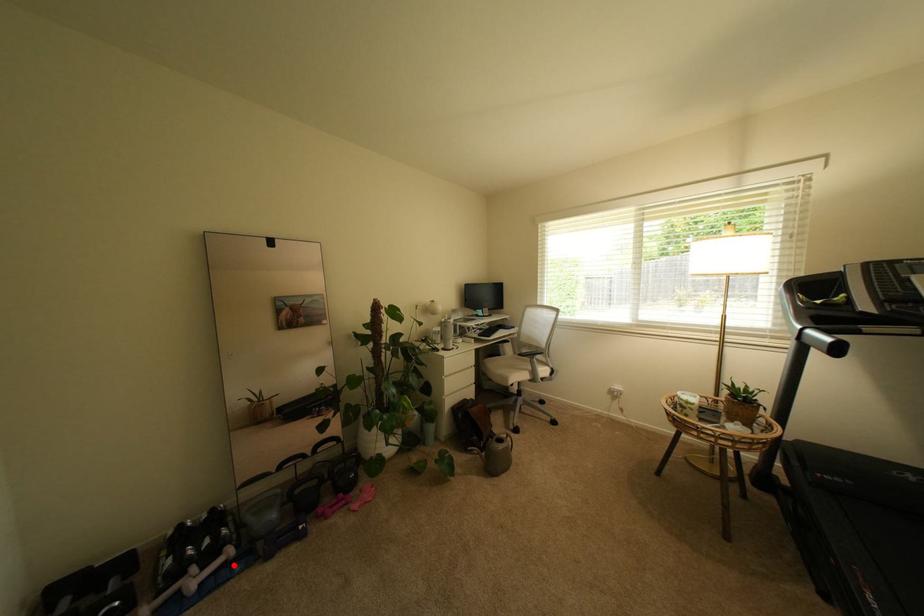
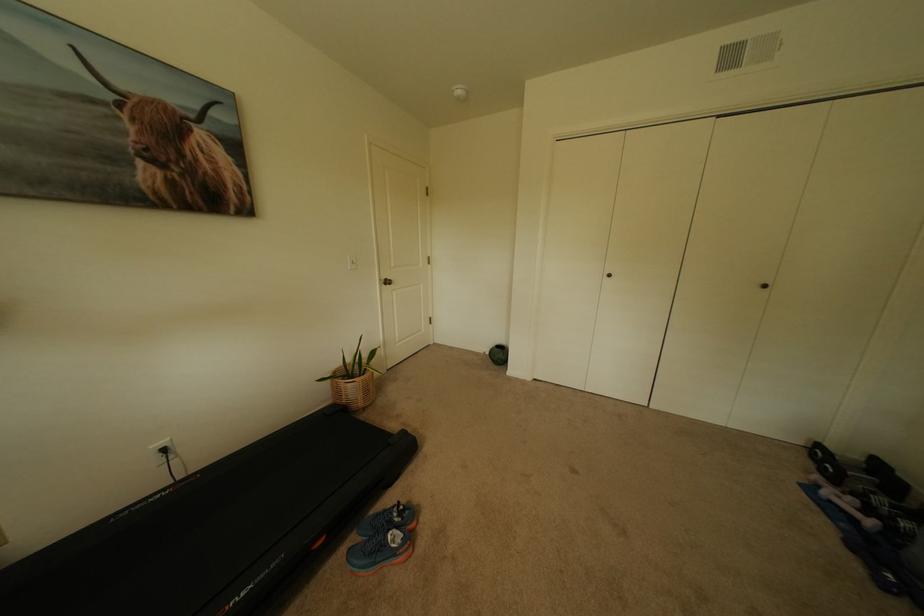
Question: A red point is marked in image1. In image2, is the corresponding 3D point closer to the camera or farther? Reply with the corresponding letter.

Choices:
 (A) The corresponding 3D point is closer.
 (B) The corresponding 3D point is farther.

Answer: (A)